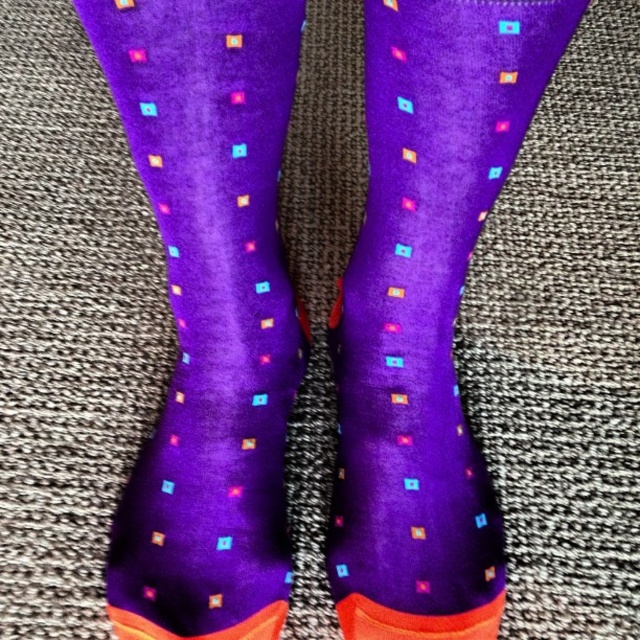
Question: Which point is closer to the camera taking this photo?

Choices:
 (A) (572, 29)
 (B) (282, 579)

Answer: (A)

Question: Among these points, which one is nearest to the camera?

Choices:
 (A) coord(388,595)
 (B) coord(163,115)

Answer: (B)

Question: Can you confirm if purple velvet socks at center is smaller than purple matte socks at center?

Choices:
 (A) yes
 (B) no

Answer: (B)

Question: Which object is farther from the camera taking this photo?

Choices:
 (A) purple velvet socks at center
 (B) purple matte socks at center

Answer: (A)

Question: Considering the relative positions of purple velvet socks at center and purple matte socks at center in the image provided, where is purple velvet socks at center located with respect to purple matte socks at center?

Choices:
 (A) right
 (B) left

Answer: (B)

Question: Is purple velvet socks at center below purple matte socks at center?

Choices:
 (A) no
 (B) yes

Answer: (A)